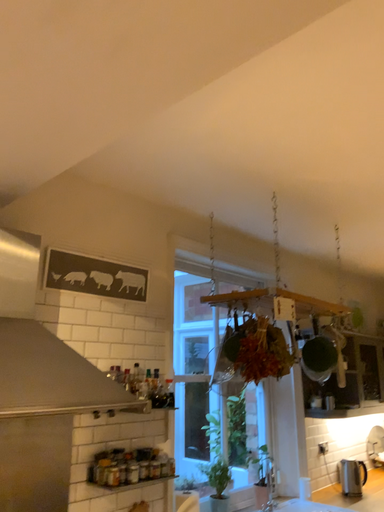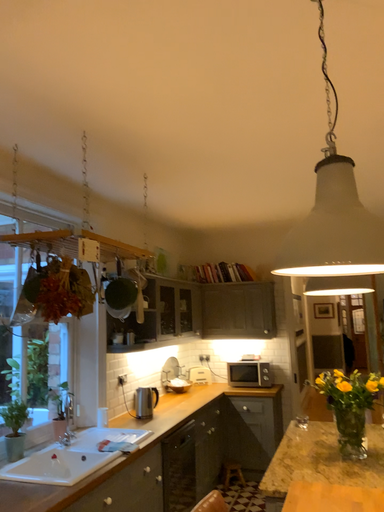
Question: Which way did the camera rotate in the video?

Choices:
 (A) rotated right
 (B) rotated left

Answer: (A)